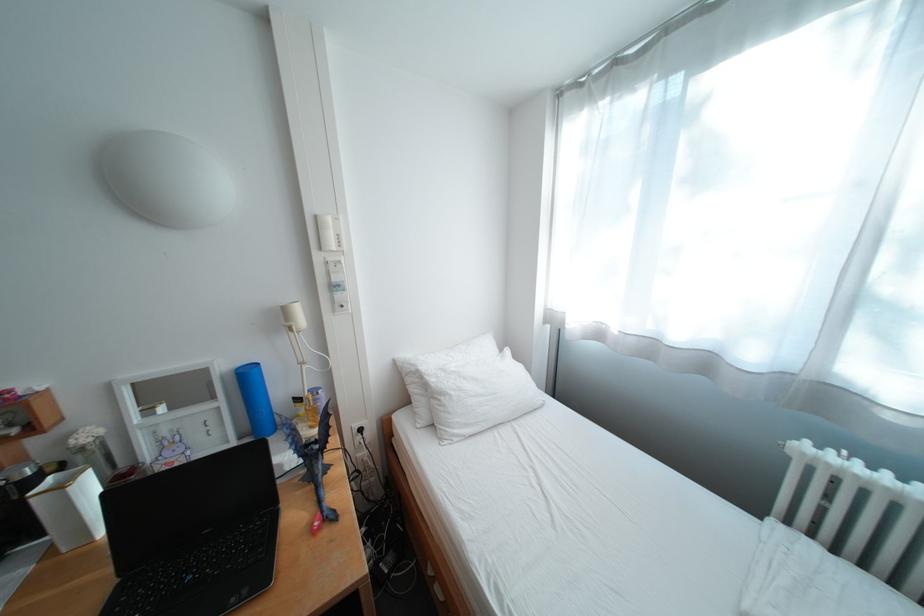
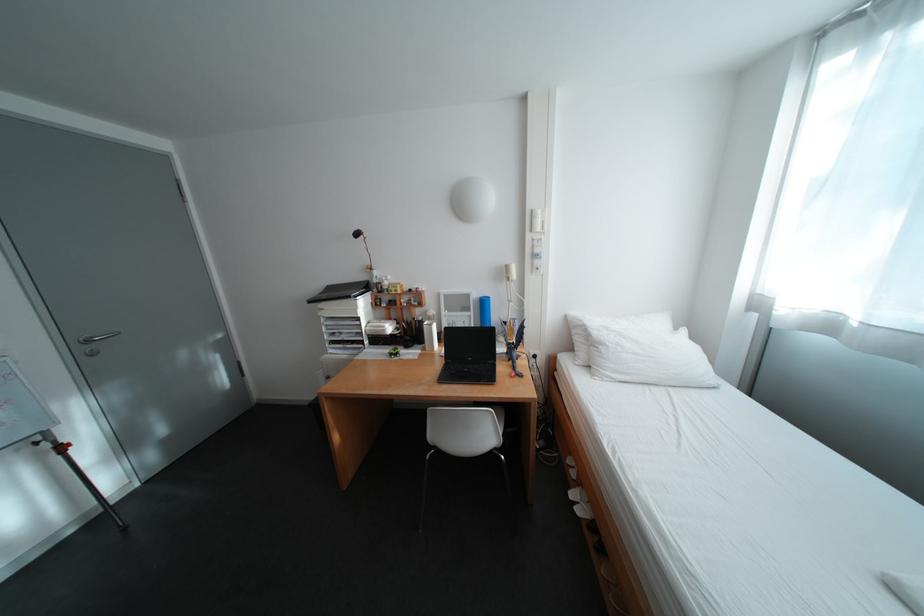
Find the pixel in the second image that matches point (456, 397) in the first image.

(614, 346)